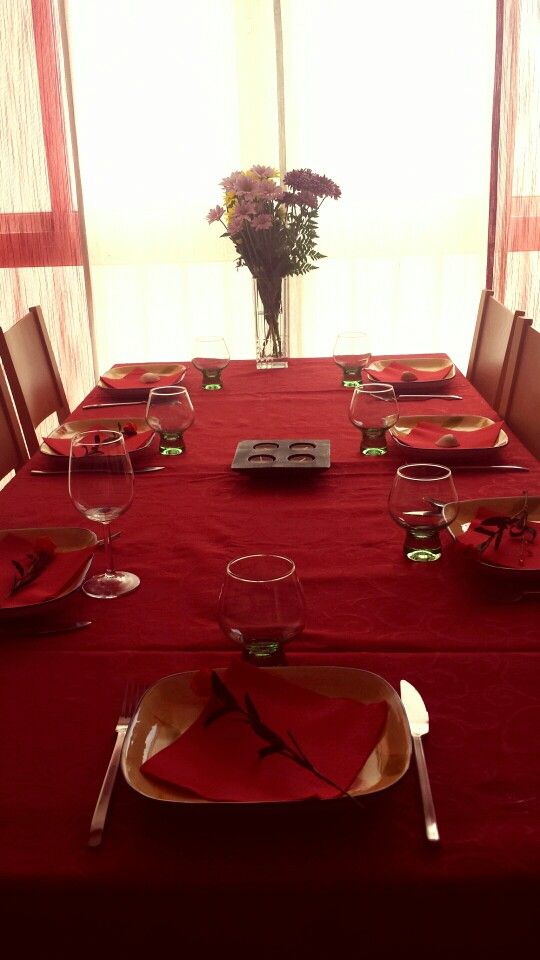
The width and height of the screenshot is (540, 960). I want to click on cloth napkins, so click(x=268, y=764), click(x=35, y=573), click(x=135, y=438), click(x=129, y=381), click(x=431, y=372), click(x=472, y=439), click(x=505, y=548).